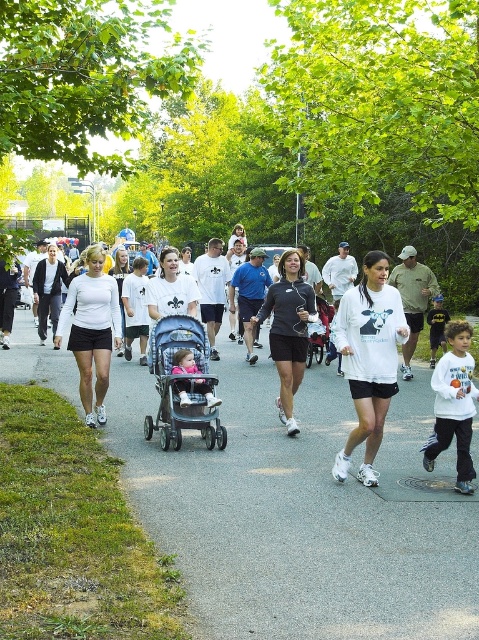
You are a runner preparing to sprint across the gray asphalt pavement at center and the white matte shorts at center. Which surface should you choose to ensure your sprint is on a wider path?

The gray asphalt pavement at center has a larger width than the white matte shorts at center, so you should sprint on the gray asphalt pavement at center for a wider path.

You are a photographer positioned at the start of the path. You want to capture a photo that includes both the blue fabric stroller at center and the matte black running outfit at center. Based on their positions, which object should you focus on first to ensure both are in frame?

The blue fabric stroller at center is located below matte black running outfit at center, so you should focus on the matte black running outfit at center first to ensure both are in frame.

You are a runner preparing to start a race and see the gray asphalt pavement at center and the matte pink stroller at center. Which surface should you choose to run on for better traction?

The gray asphalt pavement at center is larger in size than the matte pink stroller at center, so you should run on the gray asphalt pavement at center for better traction.